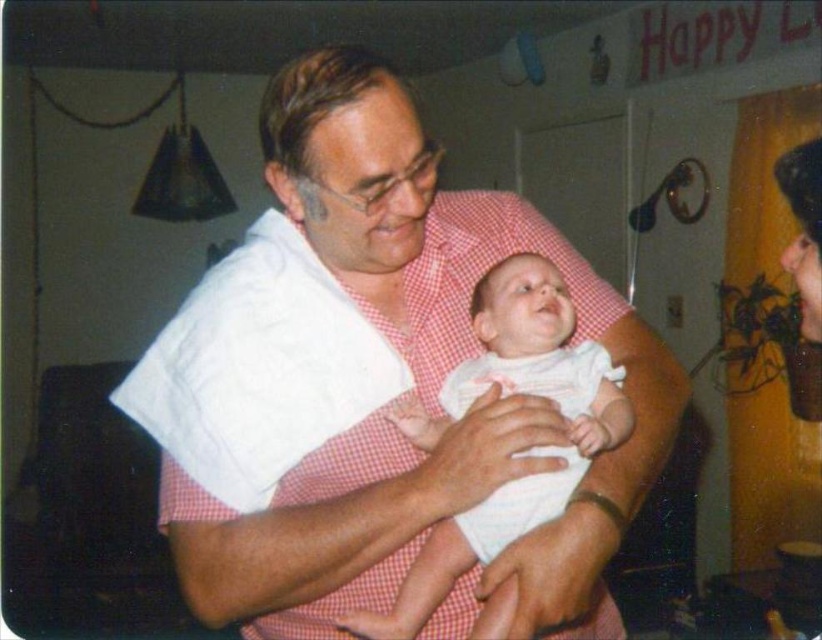
Question: Which point is closer to the camera?

Choices:
 (A) (790, 266)
 (B) (181, 378)

Answer: (B)

Question: In this image, where is white cotton baby at center located relative to smooth skin face at right?

Choices:
 (A) right
 (B) left

Answer: (B)

Question: Which point appears closest to the camera in this image?

Choices:
 (A) (797, 243)
 (B) (187, 557)
 (C) (583, 316)
 (D) (590, 432)

Answer: (D)

Question: Where is white clothed arm at center located in relation to smooth skin face at right in the image?

Choices:
 (A) left
 (B) right

Answer: (A)

Question: Which of the following is the closest to the observer?

Choices:
 (A) smooth skin face at right
 (B) white clothed arm at center
 (C) white cotton baby at center

Answer: (B)

Question: Is white cotton baby at center closer to the viewer compared to smooth skin face at right?

Choices:
 (A) yes
 (B) no

Answer: (A)